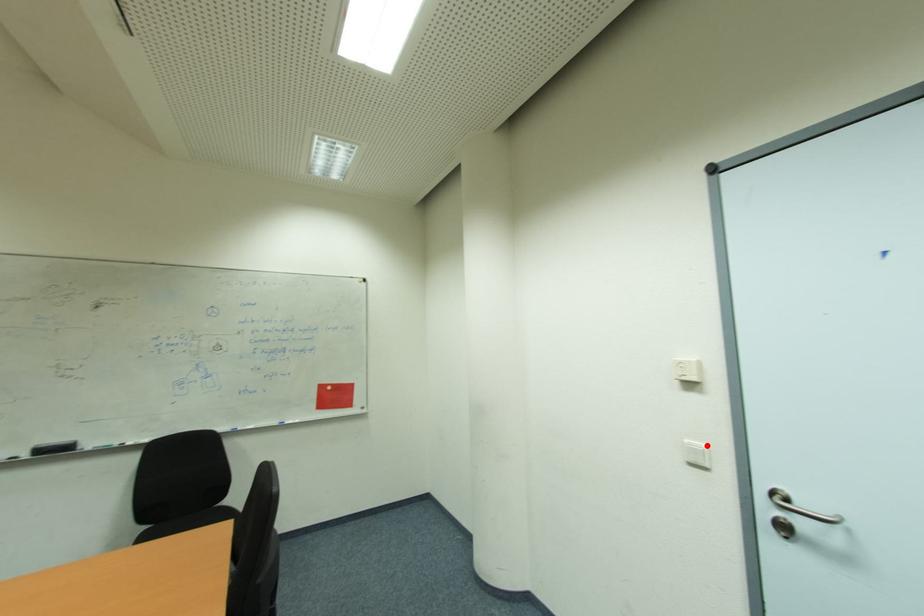
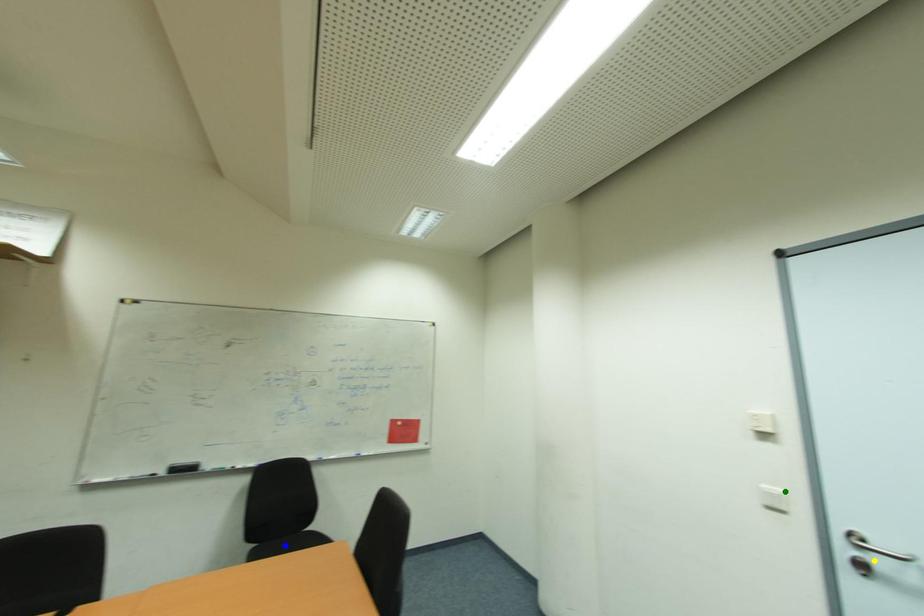
Question: I am providing you with two images of the same scene from different viewpoints. A red point is marked on the first image. You are given multiple points on the second image. In image 2, which mark is for the same physical point as the one in image 1?

Choices:
 (A) green point
 (B) blue point
 (C) yellow point

Answer: (A)